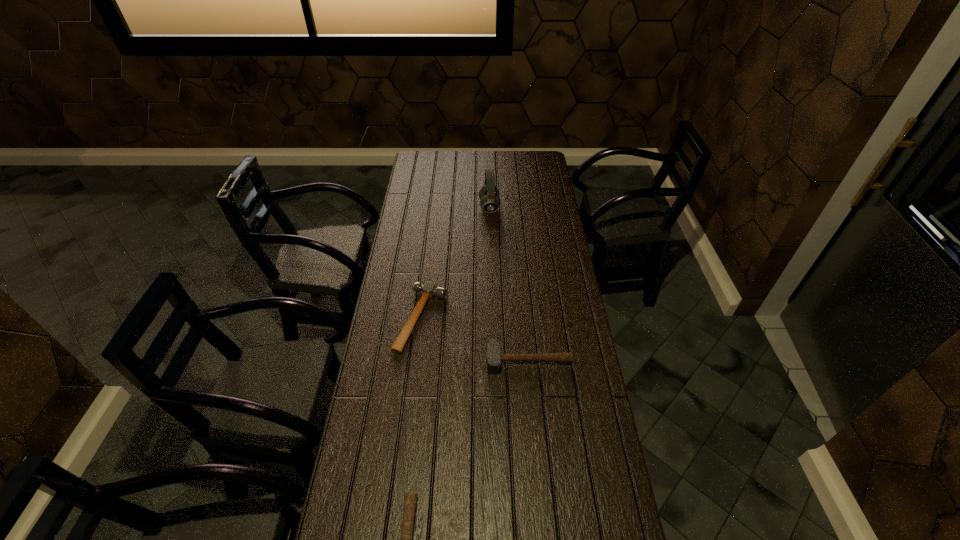
What are the coordinates of `object that is at the right edge` in the screenshot? It's located at (493, 357).

Where is `vacant space at the left edge`? This screenshot has width=960, height=540. vacant space at the left edge is located at coordinates (368, 393).

The width and height of the screenshot is (960, 540). Find the location of `free space at the right edge of the desktop`. free space at the right edge of the desktop is located at coordinates (564, 512).

Locate an element on the screen. The width and height of the screenshot is (960, 540). free space at the far left corner of the desktop is located at coordinates 427,156.

Locate an element on the screen. The image size is (960, 540). free point between the headset and the rightmost hammer is located at coordinates (509, 283).

Locate an element on the screen. The width and height of the screenshot is (960, 540). vacant region between the rightmost hammer and the farthest object is located at coordinates (509, 283).

You are a GUI agent. You are given a task and a screenshot of the screen. Output one action in this format:
    pyautogui.click(x=<x>, y=<y>)
    Task: Click on the unoccupied position between the farthest object and the second tallest hammer
    This screenshot has height=540, width=960.
    Given the screenshot: What is the action you would take?
    pyautogui.click(x=455, y=263)

Locate an element on the screen. This screenshot has height=540, width=960. free space between the rightmost hammer and the farthest object is located at coordinates (509, 283).

The width and height of the screenshot is (960, 540). Find the location of `free spot between the rightmost hammer and the farthest object`. free spot between the rightmost hammer and the farthest object is located at coordinates (509, 283).

In order to click on the third closest object relative to the shortest hammer in this screenshot , I will do `click(489, 198)`.